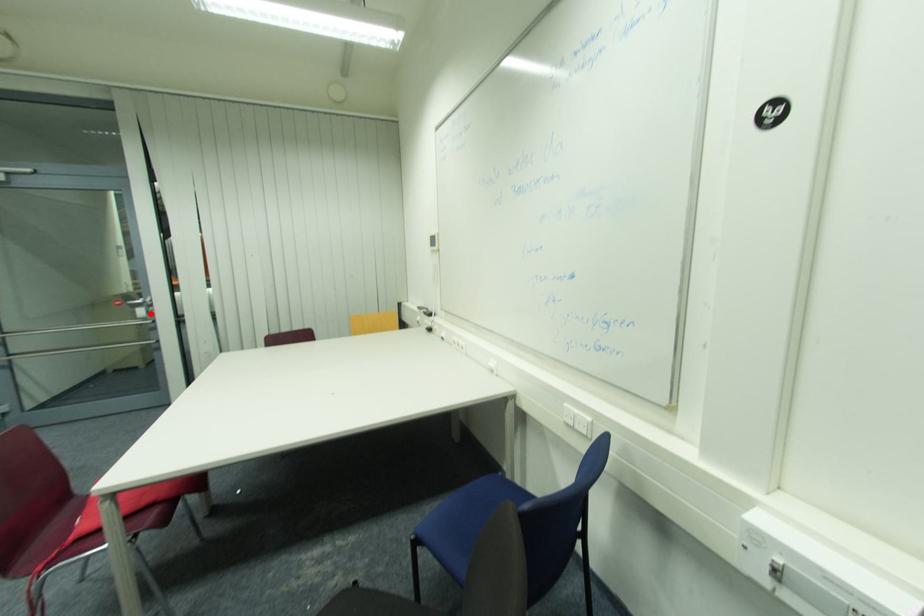
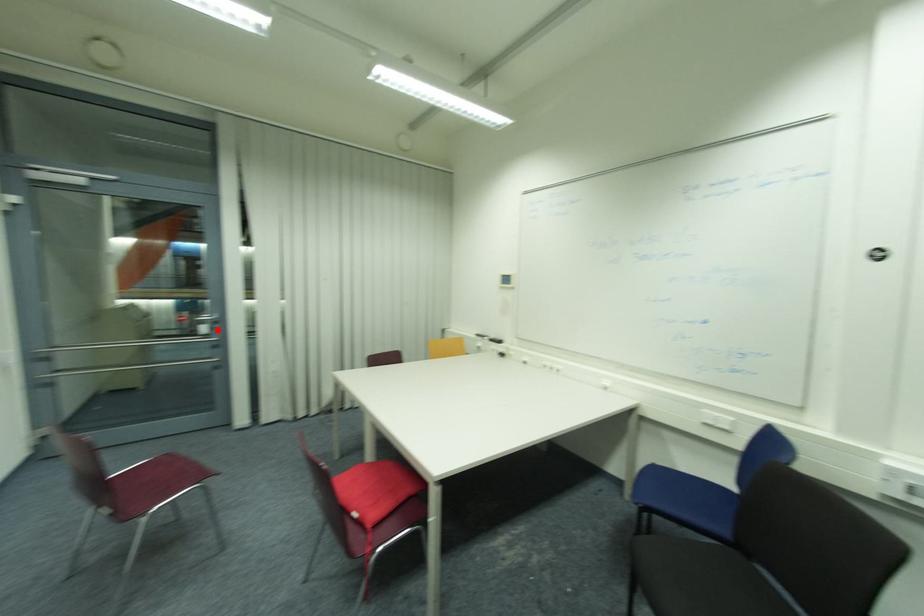
I am providing you with two images of the same scene from different viewpoints. A red point is marked on the first image and another point is marked on the second image. Are the points marked in image1 and image2 representing the same 3D position?

Yes